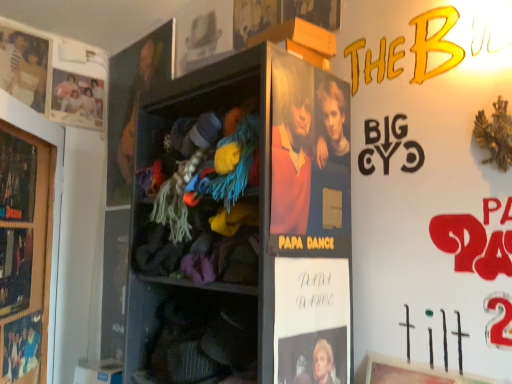
Locate an element on the screen. matte paper poster at center, the 3th person viewed from the left is located at coordinates (291, 145).

What do you see at coordinates (136, 102) in the screenshot? I see `matte black guitar at upper left, the second person viewed from the right` at bounding box center [136, 102].

Where is `matte cardboard poster at upper center, the third movie poster when ordered from left to right`? The image size is (512, 384). matte cardboard poster at upper center, the third movie poster when ordered from left to right is located at coordinates click(x=203, y=35).

The height and width of the screenshot is (384, 512). Find the location of `matte cardboard movie poster at lower left, the third movie poster from the right`. matte cardboard movie poster at lower left, the third movie poster from the right is located at coordinates (21, 346).

This screenshot has height=384, width=512. What are the coordinates of `matte paper poster at center, the 3th person viewed from the left` in the screenshot? It's located at (291, 145).

Is matte paper movie poster at upper center, the 1th movie poster positioned from the top, bigger than matte paper poster at center, the third person viewed from the back?

Incorrect, matte paper movie poster at upper center, the 1th movie poster positioned from the top, is not larger than matte paper poster at center, the third person viewed from the back.

From a real-world perspective, is matte paper movie poster at upper center, the 4th movie poster positioned from the left, physically above matte paper poster at center, the third person viewed from the back?

Yes, from a real-world perspective, matte paper movie poster at upper center, the 4th movie poster positioned from the left, is on top of matte paper poster at center, the third person viewed from the back.

Which object is closer to the camera taking this photo, matte paper movie poster at upper center, the 4th movie poster positioned from the left, or matte paper poster at center, acting as the first person starting from the front?

matte paper poster at center, acting as the first person starting from the front, is more forward.

Can you confirm if matte black guitar at upper left, the second person viewed from the right, is wider than matte cardboard poster at upper center, which is the second movie poster in right-to-left order?

Incorrect, the width of matte black guitar at upper left, the second person viewed from the right, does not surpass that of matte cardboard poster at upper center, which is the second movie poster in right-to-left order.

Can you confirm if matte black guitar at upper left, arranged as the 2th person when viewed from the left, is positioned to the left of matte cardboard poster at upper center, arranged as the 2th movie poster when viewed from the top?

Yes.

From a real-world perspective, which is physically above, matte black guitar at upper left, the 2th person in the front-to-back sequence, or matte cardboard poster at upper center, the third movie poster when ordered from left to right?

From a 3D spatial view, matte cardboard poster at upper center, the third movie poster when ordered from left to right, is above.

Does point (32, 208) come closer to viewer compared to point (328, 355)?

No.

Is matte black poster at center, the first advertisement from the right, surrounded by matte black poster at left, arranged as the 2th advertisement when viewed from the left?

No, matte black poster at center, the first advertisement from the right, is not surrounded by matte black poster at left, arranged as the 2th advertisement when viewed from the left.

Considering the sizes of objects matte black poster at left, which is counted as the 2th advertisement, starting from the right, and matte black poster at center, which appears as the third advertisement when viewed from the left, in the image provided, who is smaller, matte black poster at left, which is counted as the 2th advertisement, starting from the right, or matte black poster at center, which appears as the third advertisement when viewed from the left,?

matte black poster at center, which appears as the third advertisement when viewed from the left, is smaller.

Is matte white family portrait at upper left, positioned as the first person in left-to-right order, completely or partially inside wooden shelf at center?

No, matte white family portrait at upper left, positioned as the first person in left-to-right order, is not a part of wooden shelf at center.

Based on the photo, considering the positions of objects wooden shelf at center and matte white family portrait at upper left, the 3th person when ordered from front to back, in the image provided, who is more to the right, wooden shelf at center or matte white family portrait at upper left, the 3th person when ordered from front to back,?

Positioned to the right is wooden shelf at center.

Is wooden shelf at center far from matte white family portrait at upper left, positioned as the first person in left-to-right order?

wooden shelf at center is far away from matte white family portrait at upper left, positioned as the first person in left-to-right order.

What's the angular difference between wooden shelf at center and matte white family portrait at upper left, which appears as the 1th person when viewed from the back,'s facing directions?

The angle between the facing direction of wooden shelf at center and the facing direction of matte white family portrait at upper left, which appears as the 1th person when viewed from the back, is 89.9 degrees.

From the image's perspective, relative to matte black poster at center, the first advertisement from the right, is wooden framed poster at left, the third advertisement from the right, above or below?

wooden framed poster at left, the third advertisement from the right, is situated higher than matte black poster at center, the first advertisement from the right, in the image.

Would you say wooden framed poster at left, the 1th advertisement from the left, contains matte black poster at center, the first advertisement from the right?

No, matte black poster at center, the first advertisement from the right, is not surrounded by wooden framed poster at left, the 1th advertisement from the left.

Considering the relative positions of wooden framed poster at left, the 1th advertisement from the left, and matte black poster at center, the first advertisement from the right, in the image provided, is wooden framed poster at left, the 1th advertisement from the left, to the left or to the right of matte black poster at center, the first advertisement from the right,?

In the image, wooden framed poster at left, the 1th advertisement from the left, appears on the left side of matte black poster at center, the first advertisement from the right.

Is point (13, 175) more distant than point (316, 358)?

That is True.

Between matte black poster at left, which is counted as the 2th advertisement, starting from the right, and matte paper poster at upper left, which ranks as the second movie poster in bottom-to-top order, which one has less height?

Standing shorter between the two is matte black poster at left, which is counted as the 2th advertisement, starting from the right.

What's the angular difference between matte black poster at left, arranged as the 2th advertisement when viewed from the left, and matte paper poster at upper left, the 3th movie poster from the top,'s facing directions?

The facing directions of matte black poster at left, arranged as the 2th advertisement when viewed from the left, and matte paper poster at upper left, the 3th movie poster from the top, are 50.5 degrees apart.

Is matte black poster at left, which is counted as the 2th advertisement, starting from the right, facing towards matte paper poster at upper left, acting as the 4th movie poster starting from the right?

No, matte black poster at left, which is counted as the 2th advertisement, starting from the right, is not facing towards matte paper poster at upper left, acting as the 4th movie poster starting from the right.

Is matte black poster at left, which is counted as the 2th advertisement, starting from the right, directly adjacent to matte paper poster at upper left, the 3th movie poster from the top?

No, matte black poster at left, which is counted as the 2th advertisement, starting from the right, is not beside matte paper poster at upper left, the 3th movie poster from the top.

Does matte black poster at center, which appears as the third advertisement when viewed from the left, have a greater height compared to matte black poster at left, arranged as the 2th advertisement when viewed from the left?

No, matte black poster at center, which appears as the third advertisement when viewed from the left, is not taller than matte black poster at left, arranged as the 2th advertisement when viewed from the left.

Are matte black poster at center, which appears as the third advertisement when viewed from the left, and matte black poster at left, which is counted as the 2th advertisement, starting from the right, making contact?

No, matte black poster at center, which appears as the third advertisement when viewed from the left, is not touching matte black poster at left, which is counted as the 2th advertisement, starting from the right.

Is matte black poster at center, which appears as the third advertisement when viewed from the left, to the left of matte black poster at left, arranged as the 2th advertisement when viewed from the left, from the viewer's perspective?

Incorrect, matte black poster at center, which appears as the third advertisement when viewed from the left, is not on the left side of matte black poster at left, arranged as the 2th advertisement when viewed from the left.

Image resolution: width=512 pixels, height=384 pixels. What are the coordinates of `person lying on the right of matte paper movie poster at upper center, arranged as the 1th movie poster when viewed from the right` in the screenshot? It's located at (291, 145).

The width and height of the screenshot is (512, 384). Find the location of `the 1st person to the left of the matte cardboard poster at upper center, arranged as the 2th movie poster when viewed from the top, starting your count from the anchor`. the 1st person to the left of the matte cardboard poster at upper center, arranged as the 2th movie poster when viewed from the top, starting your count from the anchor is located at coordinates (136, 102).

Estimate the real-world distances between objects in this image. Which object is closer to matte paper poster at center, placed as the first person when sorted from right to left, wooden framed poster at left, the 1th advertisement from the left, or matte cardboard poster at upper center, placed as the 3th movie poster when sorted from bottom to top?

matte cardboard poster at upper center, placed as the 3th movie poster when sorted from bottom to top, is closer to matte paper poster at center, placed as the first person when sorted from right to left.

From the image, which object appears to be nearer to matte paper poster at center, the 3th person viewed from the left, matte black poster at left, arranged as the 2th advertisement when viewed from the left, or matte cardboard movie poster at lower left, which is counted as the second movie poster, starting from the left?

matte black poster at left, arranged as the 2th advertisement when viewed from the left, is positioned closer to the anchor matte paper poster at center, the 3th person viewed from the left.

Based on their spatial positions, is wooden shelf at center or matte cardboard movie poster at lower left, which is counted as the second movie poster, starting from the left, closer to matte white family portrait at upper left, which is counted as the third person, starting from the right?

The object closer to matte white family portrait at upper left, which is counted as the third person, starting from the right, is matte cardboard movie poster at lower left, which is counted as the second movie poster, starting from the left.

Estimate the real-world distances between objects in this image. Which object is further from matte black guitar at upper left, positioned as the 2th person in back-to-front order, matte white family portrait at upper left, which appears as the 1th person when viewed from the back, or matte paper poster at upper left, acting as the 4th movie poster starting from the right?

Based on the image, matte paper poster at upper left, acting as the 4th movie poster starting from the right, appears to be further to matte black guitar at upper left, positioned as the 2th person in back-to-front order.

From the image, which object appears to be farther from matte black poster at center, which appears as the third advertisement when viewed from the left, matte paper movie poster at upper center, the 4th movie poster positioned from the left, or matte paper poster at upper left, which ranks as the second movie poster in bottom-to-top order?

matte paper poster at upper left, which ranks as the second movie poster in bottom-to-top order.

Looking at the image, which one is located further to matte black poster at center, the first advertisement from the right, matte black guitar at upper left, positioned as the 2th person in back-to-front order, or wooden shelf at center?

matte black guitar at upper left, positioned as the 2th person in back-to-front order, lies further to matte black poster at center, the first advertisement from the right, than the other object.

Estimate the real-world distances between objects in this image. Which object is closer to matte black poster at center, which appears as the third advertisement when viewed from the left, wooden shelf at center or matte cardboard movie poster at lower left, which is the fourth movie poster from top to bottom?

Among the two, wooden shelf at center is located nearer to matte black poster at center, which appears as the third advertisement when viewed from the left.

Considering their positions, is wooden shelf at center positioned further to matte paper poster at center, placed as the first person when sorted from right to left, than matte paper poster at upper left, marked as the first movie poster in a left-to-right arrangement?

Among the two, matte paper poster at upper left, marked as the first movie poster in a left-to-right arrangement, is located further to matte paper poster at center, placed as the first person when sorted from right to left.

I want to click on shelf between matte cardboard poster at upper center, which is the second movie poster in right-to-left order, and matte cardboard movie poster at lower left, which is counted as the second movie poster, starting from the left, in the vertical direction, so click(x=243, y=225).

What are the coordinates of `shelf situated between matte black poster at left, which is counted as the 2th advertisement, starting from the right, and matte paper poster at center, the third person viewed from the back, from left to right` in the screenshot? It's located at (243, 225).

At what (x,y) coordinates should I click in order to perform the action: click on movie poster between matte black guitar at upper left, positioned as the 2th person in back-to-front order, and matte paper movie poster at upper center, arranged as the 1th movie poster when viewed from the right, in the horizontal direction. Please return your answer as a coordinate pair (x, y). The width and height of the screenshot is (512, 384). Looking at the image, I should click on (203, 35).

This screenshot has width=512, height=384. I want to click on advertisement between wooden framed poster at left, the 1th advertisement from the left, and wooden shelf at center, so click(17, 178).